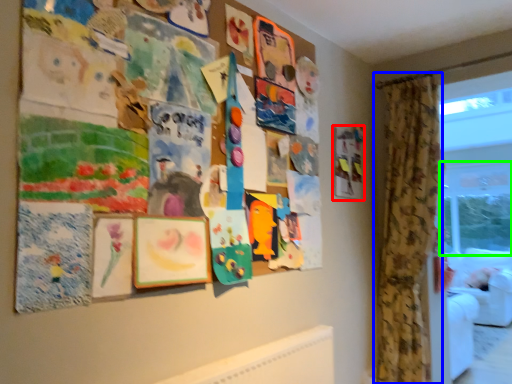
Question: Which object is positioned closest to picture frame (highlighted by a red box)? Select from curtain (highlighted by a blue box) and window screen (highlighted by a green box).

Choices:
 (A) curtain
 (B) window screen

Answer: (A)